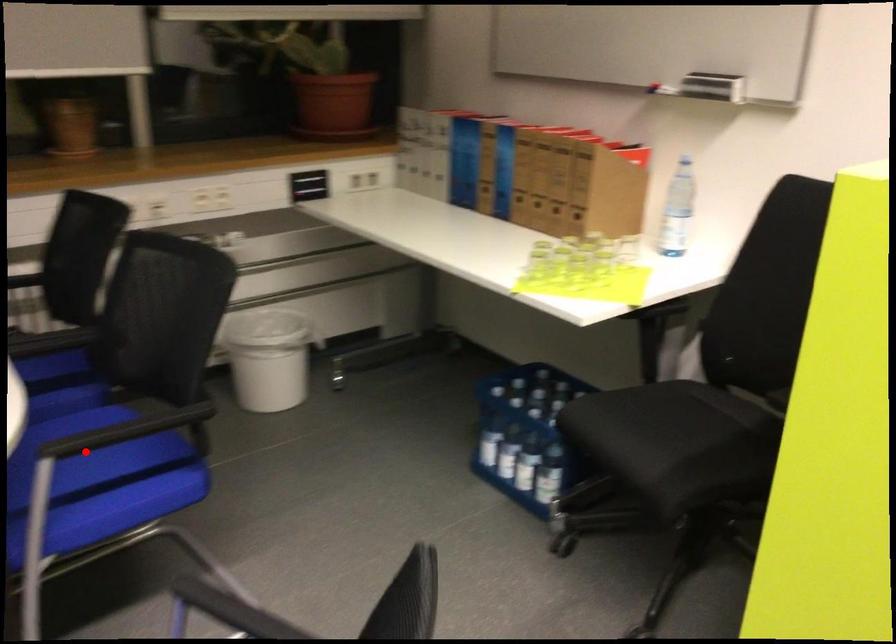
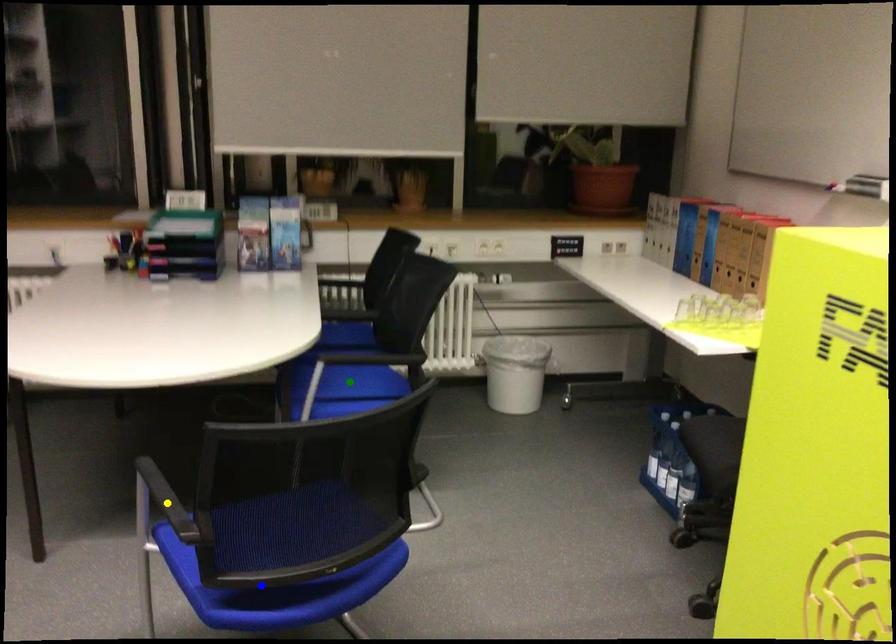
Question: I am providing you with two images of the same scene from different viewpoints. A red point is marked on the first image. You are given multiple points on the second image. Which mark in image 2 goes with the point in image 1?

Choices:
 (A) green point
 (B) blue point
 (C) yellow point

Answer: (A)